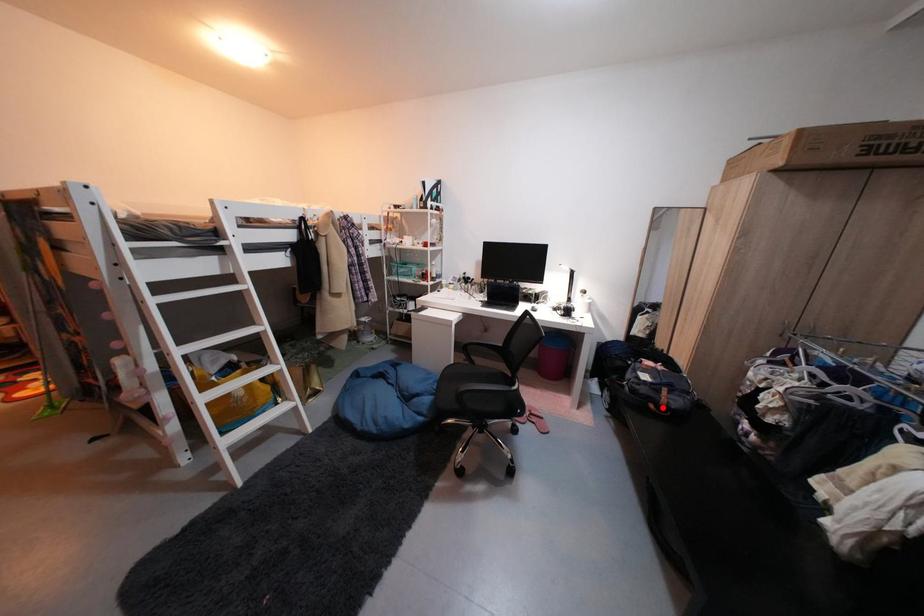
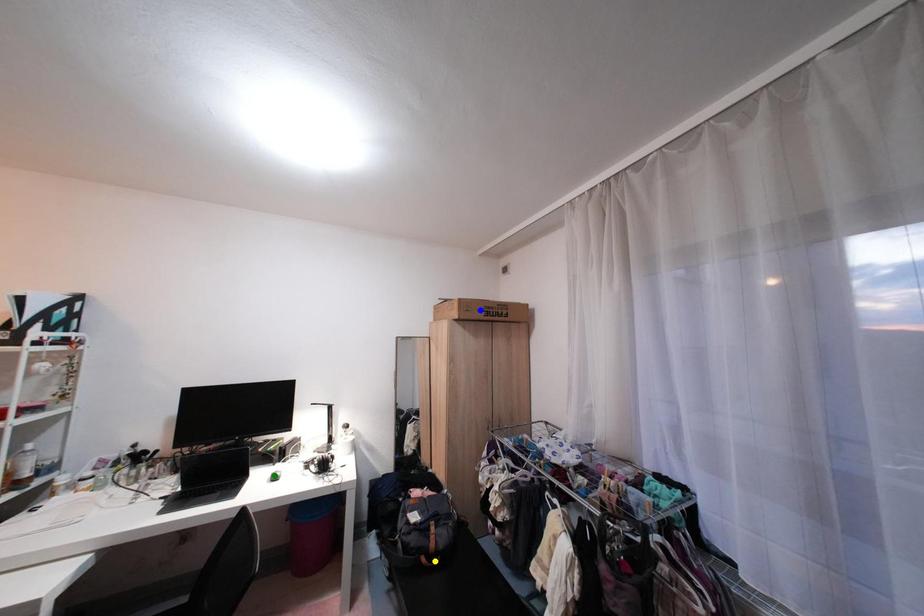
Question: I am providing you with two images of the same scene from different viewpoints. A red point is marked on the first image. You are given multiple points on the second image. Which point in image 2 is actually the same real-world point as the red point in image 1?

Choices:
 (A) blue point
 (B) green point
 (C) yellow point

Answer: (C)